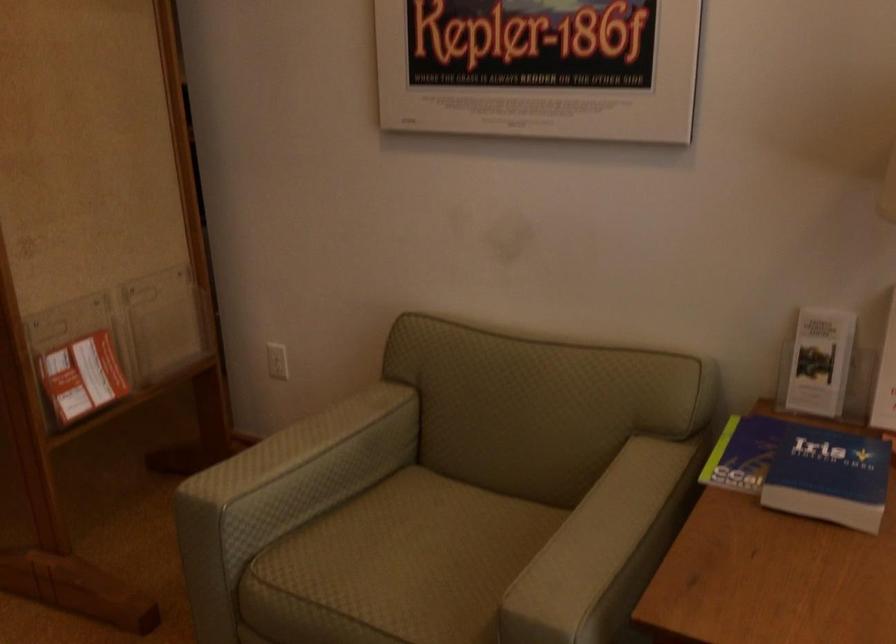
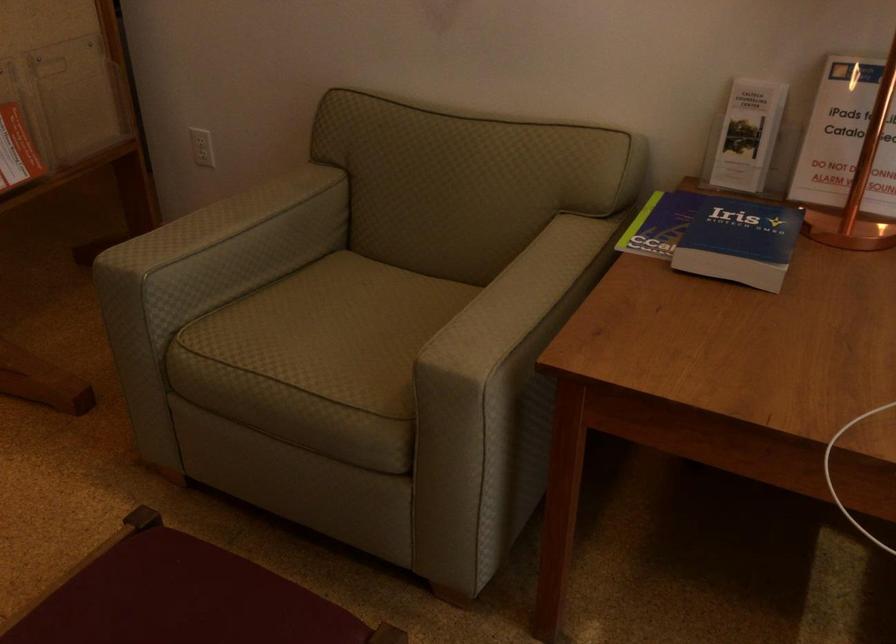
Locate, in the second image, the point that corresponds to pixel 295 450 in the first image.

(219, 222)